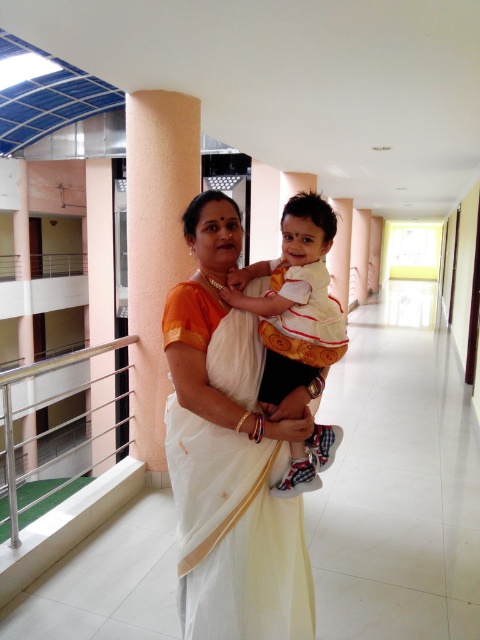
You are standing in the lobby of a modern building and want to reach the exit located near the orange textured pillar at center. The stainless steel balustrade at left is blocking your path. Which direction should you move to go around the balustrade and head towards the pillar?

The orange textured pillar at center is positioned to the right of the stainless steel balustrade at left. To reach the pillar, move to the right side of the balustrade and proceed towards the pillar.

You are an architect reviewing the building layout. You need to ensure that the orange textured pillar at center is visible from the stainless steel balustrade at left. Based on their positions, is the pillar likely visible from the balustrade?

The orange textured pillar at center is located above the stainless steel balustrade at left, so it is likely visible from the balustrade since it is positioned higher up.

You are standing in the entrance of the building and see the white silk saree at center and the stainless steel balustrade at left. Which object is closer to your right side?

The white silk saree at center is positioned on the right side of stainless steel balustrade at left, so the white silk saree at center is closer to your right side.